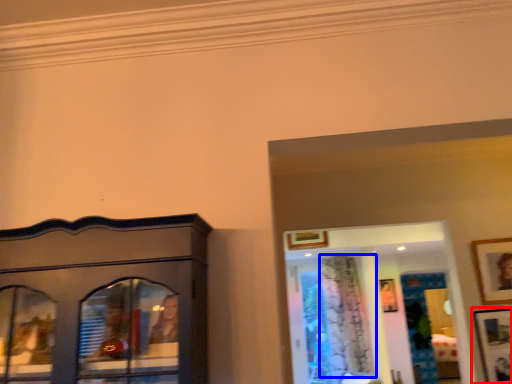
Question: Which point is closer to the camera, picture frame (highlighted by a red box) or curtain (highlighted by a blue box)?

Choices:
 (A) picture frame
 (B) curtain

Answer: (A)